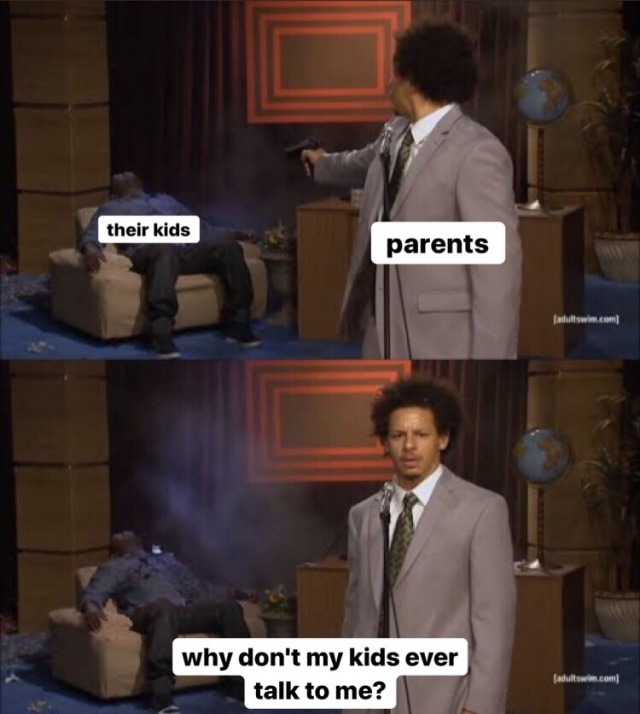
The width and height of the screenshot is (640, 714). In order to click on pillar in this screenshot , I will do `click(65, 483)`, `click(64, 100)`.